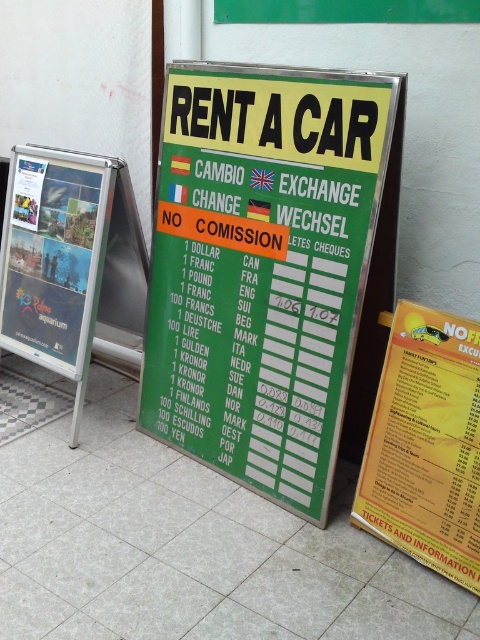
Does green plastic sign at center have a lesser height compared to metallic glossy poster at left?

No, green plastic sign at center is not shorter than metallic glossy poster at left.

Is green plastic sign at center smaller than metallic glossy poster at left?

Actually, green plastic sign at center might be larger than metallic glossy poster at left.

Is point (259, 317) closer to viewer compared to point (71, 292)?

Yes, it is in front of point (71, 292).

Identify the location of green plastic sign at center. (262, 268).

Can you confirm if yellow paper menu at center is positioned above metallic glossy poster at left?

Actually, yellow paper menu at center is below metallic glossy poster at left.

Who is shorter, yellow paper menu at center or metallic glossy poster at left?

With less height is yellow paper menu at center.

Who is more distant from viewer, (442, 356) or (75, 321)?

The point (75, 321) is more distant.

Find the location of `yellow paper menu at center`. yellow paper menu at center is located at coordinates (425, 444).

Consider the image. Can you confirm if green plastic sign at center is wider than yellow paper menu at center?

Indeed, green plastic sign at center has a greater width compared to yellow paper menu at center.

Between green plastic sign at center and yellow paper menu at center, which one appears on the right side from the viewer's perspective?

yellow paper menu at center

I want to click on green plastic sign at center, so click(262, 268).